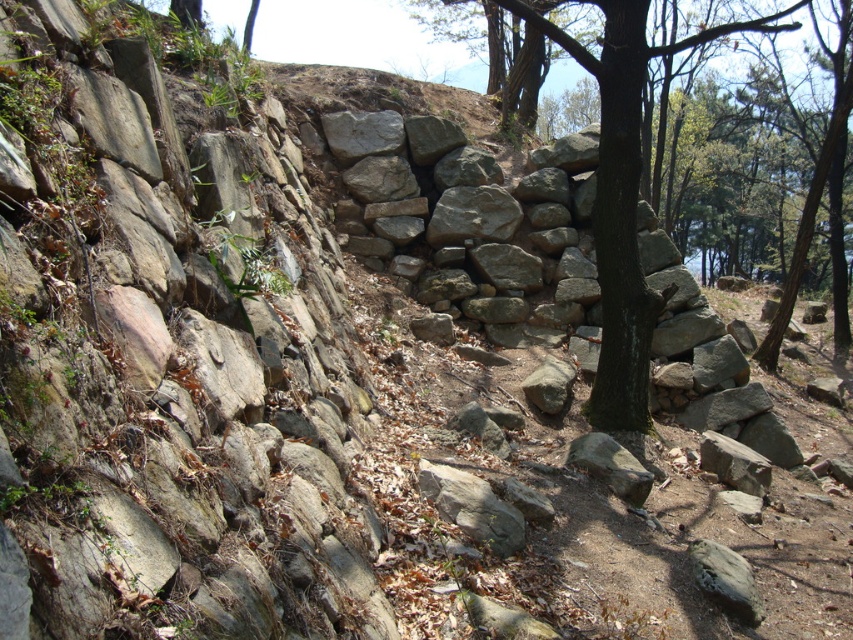
You are standing at point (167, 360) in the image. What object is located at this point?

The natural stone wall at left is located at point (167, 360).

You are a hiker who wants to take a photo of the green rough bark tree at center. You are currently standing near the natural stone wall at left. Can you see the entire tree without any obstruction?

The natural stone wall at left is in front of the green rough bark tree at center, so the wall may block part of the tree from view. Move to a position where the tree is not behind the wall to capture the full view.